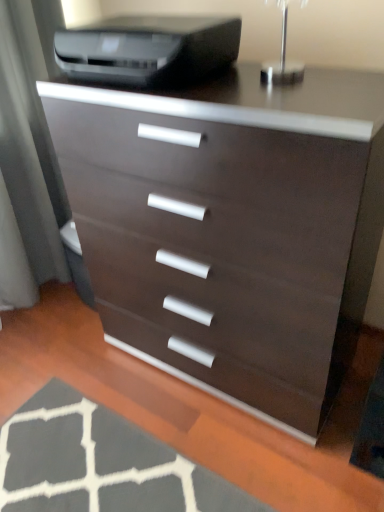
You are a GUI agent. You are given a task and a screenshot of the screen. Output one action in this format:
    pyautogui.click(x=<x>, y=<y>)
    Task: Click on the matte black printer at upper center
    
    Given the screenshot: What is the action you would take?
    pyautogui.click(x=149, y=50)

Find the location of a particular element. Image resolution: width=384 pixels, height=512 pixels. matte brown chest of drawers at center is located at coordinates (230, 228).

This screenshot has height=512, width=384. What do you see at coordinates (100, 463) in the screenshot? I see `dark gray textured rug at lower left` at bounding box center [100, 463].

Where is `matte black printer at upper center`? matte black printer at upper center is located at coordinates (149, 50).

From a real-world perspective, between matte brown chest of drawers at center and matte gray screen door at left, who is vertically lower?

matte brown chest of drawers at center is physically lower.

Can you tell me how much matte brown chest of drawers at center and matte gray screen door at left differ in facing direction?

The angle between the facing direction of matte brown chest of drawers at center and the facing direction of matte gray screen door at left is 88.5 degrees.

Is matte brown chest of drawers at center bigger than matte gray screen door at left?

Indeed, matte brown chest of drawers at center has a larger size compared to matte gray screen door at left.

Is matte gray screen door at left located within matte brown chest of drawers at center?

Definitely not — matte gray screen door at left is not inside matte brown chest of drawers at center.

Relative to matte brown chest of drawers at center, is matte black printer at upper center in front or behind?

In the image, matte black printer at upper center appears behind matte brown chest of drawers at center.

Considering the relative sizes of matte black printer at upper center and matte brown chest of drawers at center in the image provided, is matte black printer at upper center thinner than matte brown chest of drawers at center?

Yes.

Is matte black printer at upper center located outside matte brown chest of drawers at center?

matte black printer at upper center is positioned outside matte brown chest of drawers at center.

Which is behind, point (133, 82) or point (192, 258)?

Point (192, 258)

Is matte black printer at upper center facing towards matte gray screen door at left?

No, matte black printer at upper center is not facing towards matte gray screen door at left.

Measure the distance between matte black printer at upper center and matte gray screen door at left.

matte black printer at upper center and matte gray screen door at left are 25.76 inches apart from each other.

In the scene shown: From the image's perspective, is matte black printer at upper center located above matte gray screen door at left?

Yes, from the image's perspective, matte black printer at upper center is on top of matte gray screen door at left.

Locate an element on the screen. This screenshot has width=384, height=512. screen door that appears below the matte black printer at upper center (from the image's perspective) is located at coordinates (31, 133).

Which of these two, matte gray screen door at left or matte black printer at upper center, is bigger?

matte gray screen door at left.

The height and width of the screenshot is (512, 384). I want to click on printer above the matte gray screen door at left (from the image's perspective), so click(149, 50).

Between matte gray screen door at left and matte black printer at upper center, which one appears on the left side from the viewer's perspective?

matte gray screen door at left is more to the left.

Does matte gray screen door at left come in front of matte black printer at upper center?

No, matte gray screen door at left is behind matte black printer at upper center.

Is there a large distance between matte brown chest of drawers at center and dark gray textured rug at lower left?

No, matte brown chest of drawers at center is not far from dark gray textured rug at lower left.

From the image's perspective, relative to dark gray textured rug at lower left, is matte brown chest of drawers at center above or below?

Based on their image positions, matte brown chest of drawers at center is located above dark gray textured rug at lower left.

The width and height of the screenshot is (384, 512). Identify the location of doormat behind the matte brown chest of drawers at center. (100, 463).

Does matte brown chest of drawers at center lie behind matte black printer at upper center?

No, matte brown chest of drawers at center is closer to the camera.

Who is bigger, matte brown chest of drawers at center or matte black printer at upper center?

Bigger between the two is matte brown chest of drawers at center.

Consider the image. Which of these two, matte brown chest of drawers at center or matte black printer at upper center, stands taller?

With more height is matte brown chest of drawers at center.

Which object is wider, matte brown chest of drawers at center or matte black printer at upper center?

matte brown chest of drawers at center.

Is point (190, 26) behind point (57, 485)?

No, (190, 26) is in front of (57, 485).

Locate an element on the screen. The height and width of the screenshot is (512, 384). doormat on the left of matte black printer at upper center is located at coordinates (100, 463).

Is dark gray textured rug at lower left a part of matte black printer at upper center?

No, dark gray textured rug at lower left is not inside matte black printer at upper center.

Which object is positioned more to the left, matte black printer at upper center or dark gray textured rug at lower left?

dark gray textured rug at lower left.

Find the location of a particular element. This screenshot has width=384, height=512. screen door located behind the matte brown chest of drawers at center is located at coordinates (31, 133).

At what (x,y) coordinates should I click in order to perform the action: click on the chest of drawers that appears in front of the matte black printer at upper center. Please return your answer as a coordinate pair (x, y). The width and height of the screenshot is (384, 512). Looking at the image, I should click on (230, 228).

Estimate the real-world distances between objects in this image. Which object is closer to dark gray textured rug at lower left, matte brown chest of drawers at center or matte black printer at upper center?

matte brown chest of drawers at center is positioned closer to the anchor dark gray textured rug at lower left.

From the image, which object appears to be farther from matte brown chest of drawers at center, dark gray textured rug at lower left or matte black printer at upper center?

dark gray textured rug at lower left lies further to matte brown chest of drawers at center than the other object.

From the image, which object appears to be farther from dark gray textured rug at lower left, matte black printer at upper center or matte gray screen door at left?

matte black printer at upper center.

Estimate the real-world distances between objects in this image. Which object is further from matte gray screen door at left, matte brown chest of drawers at center or dark gray textured rug at lower left?

dark gray textured rug at lower left is positioned further to the anchor matte gray screen door at left.

Based on their spatial positions, is matte gray screen door at left or matte brown chest of drawers at center closer to matte black printer at upper center?

matte brown chest of drawers at center is closer to matte black printer at upper center.

Looking at this image, estimate the real-world distances between objects in this image. Which object is further from matte black printer at upper center, matte brown chest of drawers at center or dark gray textured rug at lower left?

dark gray textured rug at lower left is positioned further to the anchor matte black printer at upper center.

From the image, which object appears to be nearer to matte brown chest of drawers at center, matte gray screen door at left or matte black printer at upper center?

matte black printer at upper center lies closer to matte brown chest of drawers at center than the other object.

From the image, which object appears to be farther from dark gray textured rug at lower left, matte black printer at upper center or matte brown chest of drawers at center?

Based on the image, matte black printer at upper center appears to be further to dark gray textured rug at lower left.

Image resolution: width=384 pixels, height=512 pixels. In order to click on the chest of drawers that lies between matte gray screen door at left and dark gray textured rug at lower left from top to bottom in this screenshot , I will do `click(230, 228)`.

In order to click on printer between matte gray screen door at left and matte brown chest of drawers at center from left to right in this screenshot , I will do `click(149, 50)`.

This screenshot has width=384, height=512. I want to click on screen door between matte black printer at upper center and dark gray textured rug at lower left vertically, so click(31, 133).

Where is `chest of drawers between matte black printer at upper center and dark gray textured rug at lower left in the vertical direction`? The width and height of the screenshot is (384, 512). chest of drawers between matte black printer at upper center and dark gray textured rug at lower left in the vertical direction is located at coordinates (230, 228).